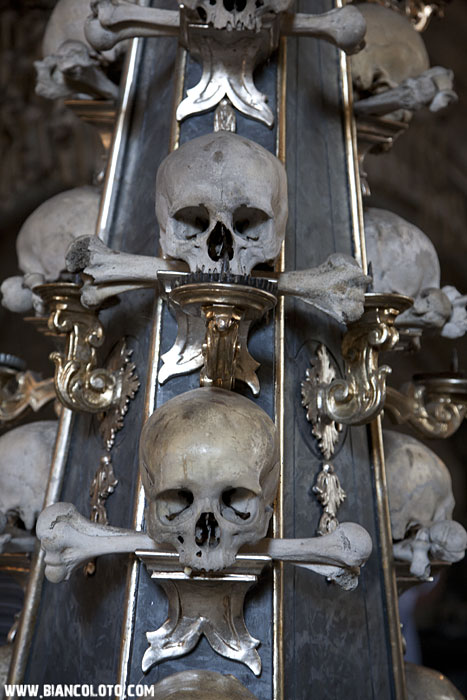
Identify the location of display. The width and height of the screenshot is (467, 700). (353, 656).